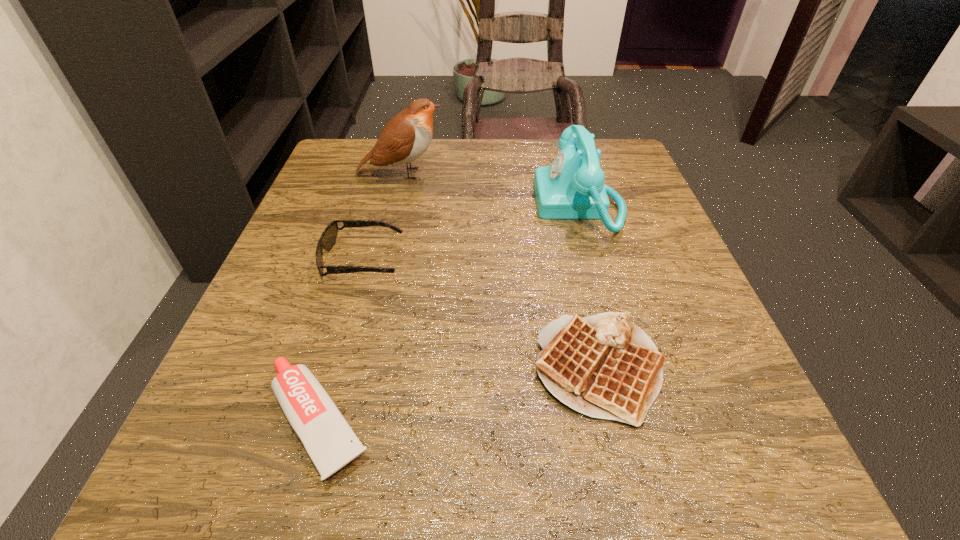
This screenshot has width=960, height=540. What are the coordinates of `the second closest object relative to the telephone` in the screenshot? It's located at (405, 138).

Find the location of `vacant space that satisfies the following two spatial constraints: 1. on the front-facing side of the sunglasses; 2. on the left side of the toothpaste`. vacant space that satisfies the following two spatial constraints: 1. on the front-facing side of the sunglasses; 2. on the left side of the toothpaste is located at coordinates (317, 421).

Where is `free spot that satisfies the following two spatial constraints: 1. on the dial of the fourth shortest object; 2. on the front side of the toothpaste`? The image size is (960, 540). free spot that satisfies the following two spatial constraints: 1. on the dial of the fourth shortest object; 2. on the front side of the toothpaste is located at coordinates (640, 421).

The image size is (960, 540). In order to click on free space in the image that satisfies the following two spatial constraints: 1. on the back side of the waffle; 2. on the front-facing side of the sunglasses in this screenshot , I will do `click(573, 260)`.